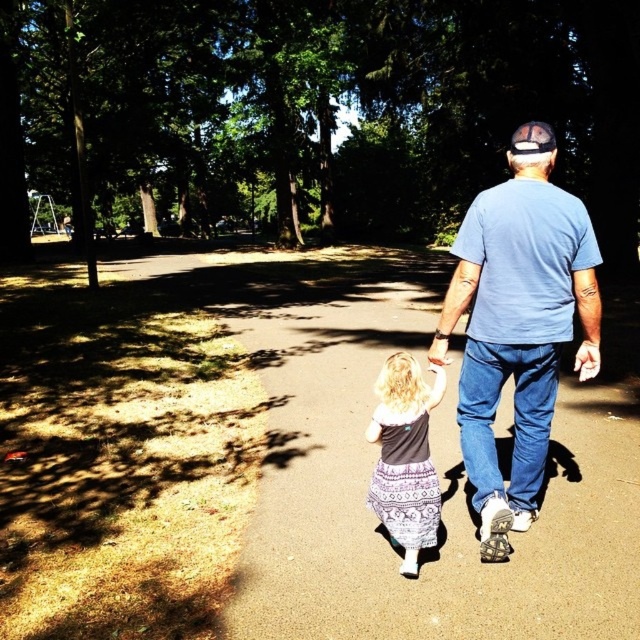
You are standing at the point labeled point (x=516, y=136) and want to walk to the point labeled point (x=560, y=344). Which direction should you face to move towards your destination?

You should face away from the viewer because point (x=560, y=344) is further away than point (x=516, y=136).